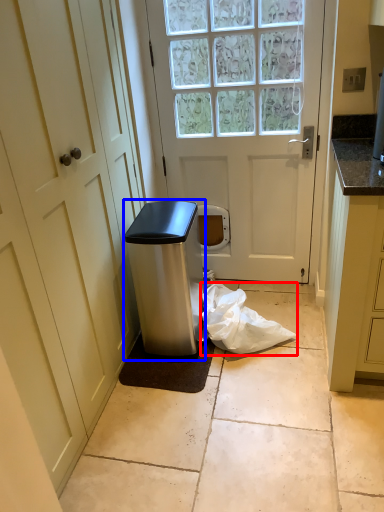
Question: Among these objects, which one is nearest to the camera, plastic bag (highlighted by a red box) or appliance (highlighted by a blue box)?

Choices:
 (A) plastic bag
 (B) appliance

Answer: (B)